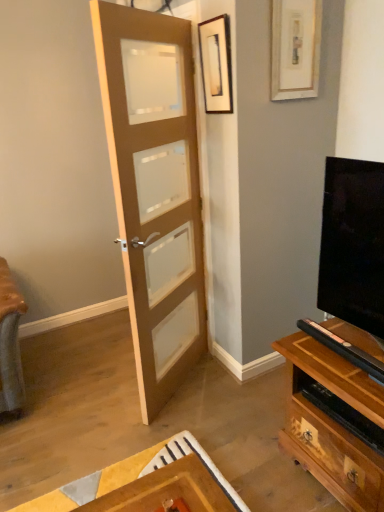
The height and width of the screenshot is (512, 384). Find the location of `free space on the front side of matte wood door at center`. free space on the front side of matte wood door at center is located at coordinates (189, 430).